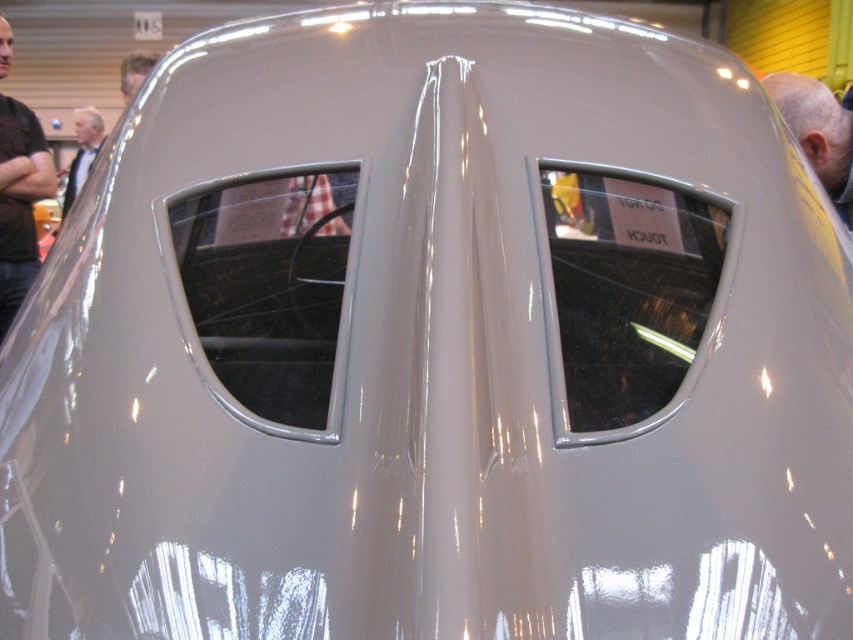
Question: Which of these objects is positioned closest to the dark brown leather shirt at left?

Choices:
 (A) gray matte head at upper right
 (B) light brown hair at upper left
 (C) light gray suit at left

Answer: (C)

Question: Can you confirm if dark brown leather shirt at left is positioned above light gray suit at left?

Choices:
 (A) yes
 (B) no

Answer: (B)

Question: Does gray matte head at upper right lie behind light gray suit at left?

Choices:
 (A) yes
 (B) no

Answer: (B)

Question: Can you confirm if dark brown leather shirt at left is positioned below light brown hair at upper left?

Choices:
 (A) no
 (B) yes

Answer: (B)

Question: Among these objects, which one is nearest to the camera?

Choices:
 (A) light brown hair at upper left
 (B) dark brown leather shirt at left
 (C) light gray suit at left

Answer: (B)

Question: Which point is farther to the camera?

Choices:
 (A) (131, 83)
 (B) (84, 172)
 (C) (840, 131)
 (D) (4, 26)

Answer: (A)